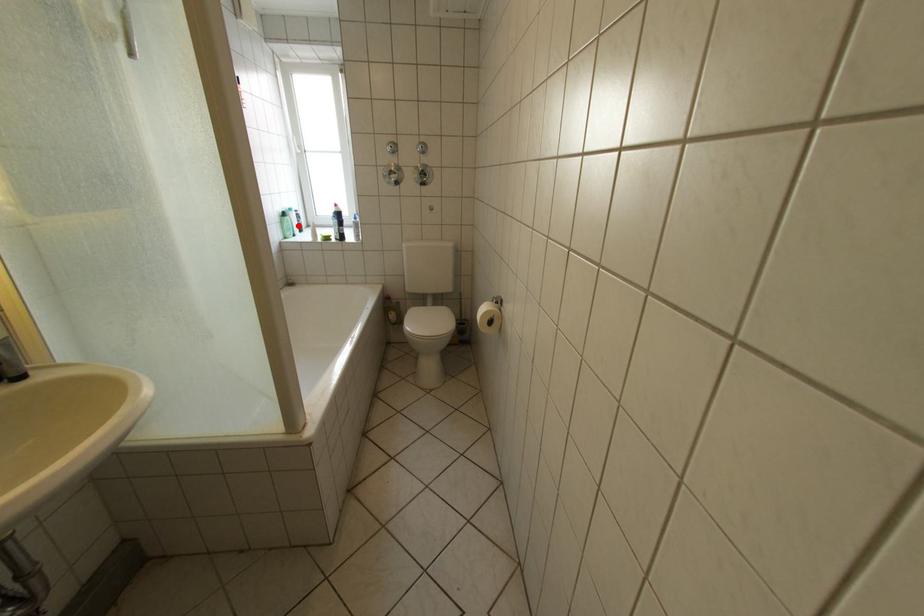
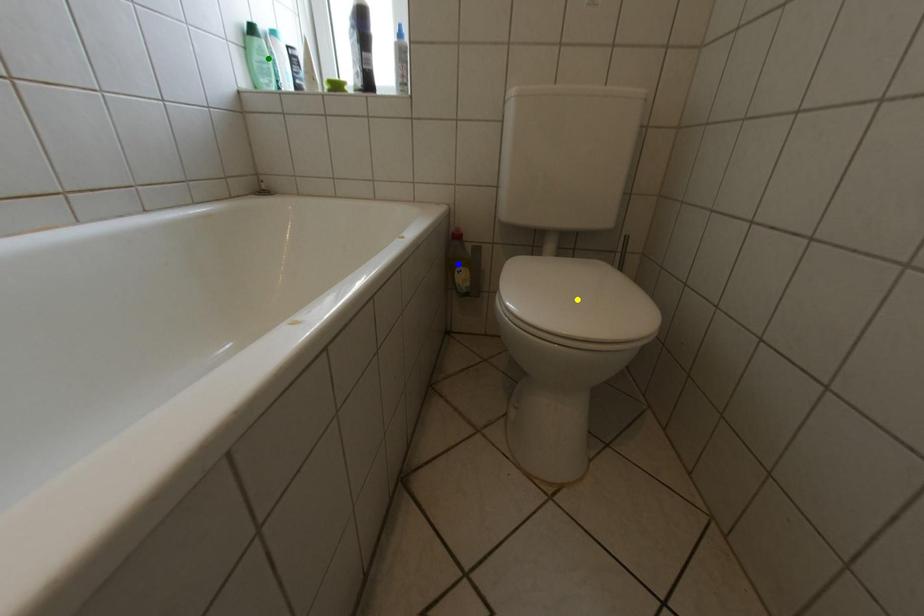
Question: I am providing you with two images of the same scene from different viewpoints. A red point is marked on the first image. You are given multiple points on the second image. In image 2, which mark is for the same physical point as the one in image 1?

Choices:
 (A) green point
 (B) yellow point
 (C) blue point

Answer: (A)